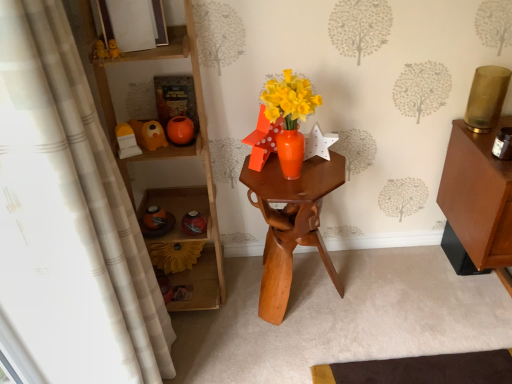
Locate an element on the screen. unoccupied area in front of wooden shelf at left is located at coordinates (226, 347).